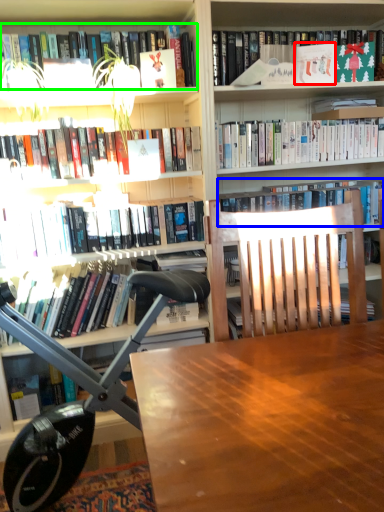
Question: Which object is the farthest from paperback book (highlighted by a red box)? Choose among these: book (highlighted by a blue box) or book (highlighted by a green box).

Choices:
 (A) book
 (B) book

Answer: (B)